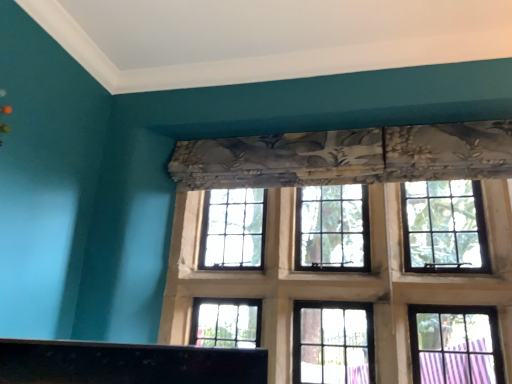
Measure the distance between patterned fabric curtain at center and camera.

A distance of 5.98 feet exists between patterned fabric curtain at center and camera.

Describe the element at coordinates (344, 236) in the screenshot. I see `patterned fabric curtain at center` at that location.

Find the location of a particular element. This screenshot has height=384, width=512. patterned fabric curtain at center is located at coordinates (344, 236).

Find the location of a particular element. This screenshot has width=512, height=384. patterned fabric curtain at center is located at coordinates (344, 236).